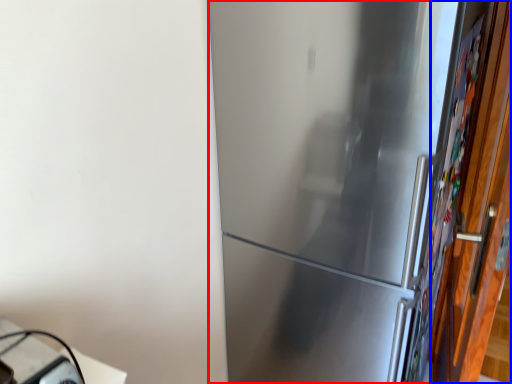
Question: Which object is further to the camera taking this photo, refrigerator (highlighted by a red box) or door (highlighted by a blue box)?

Choices:
 (A) refrigerator
 (B) door

Answer: (A)